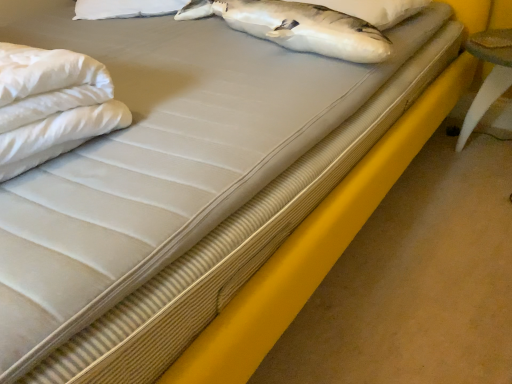
Find the location of a particular element. white soft pillow at upper center is located at coordinates (375, 9).

Describe the element at coordinates (375, 9) in the screenshot. I see `white soft pillow at upper center` at that location.

Where is `white soft fabric at left`? The image size is (512, 384). white soft fabric at left is located at coordinates (52, 105).

The image size is (512, 384). Describe the element at coordinates (52, 105) in the screenshot. I see `white soft fabric at left` at that location.

Where is `white soft pillow at upper center`? The height and width of the screenshot is (384, 512). white soft pillow at upper center is located at coordinates (375, 9).

Is white soft pillow at upper center at the left side of white soft fabric at left?

No, white soft pillow at upper center is not to the left of white soft fabric at left.

Considering their positions, is white soft pillow at upper center located in front of or behind white soft fabric at left?

white soft pillow at upper center is positioned farther from the viewer than white soft fabric at left.

Is point (361, 9) positioned before point (91, 69)?

No.

From the image's perspective, would you say white soft pillow at upper center is positioned over white soft fabric at left?

Yes, from the image's perspective, white soft pillow at upper center is over white soft fabric at left.

From a real-world perspective, is white soft pillow at upper center under white soft fabric at left?

Yes.

Considering the relative sizes of white soft pillow at upper center and white soft fabric at left in the image provided, is white soft pillow at upper center thinner than white soft fabric at left?

No.

Is white soft pillow at upper center taller or shorter than white soft fabric at left?

Considering their sizes, white soft pillow at upper center has less height than white soft fabric at left.

Which of these two, white soft pillow at upper center or white soft fabric at left, is smaller?

white soft pillow at upper center is smaller.

Is white soft pillow at upper center outside of white soft fabric at left?

Yes.

Are white soft pillow at upper center and white soft fabric at left located far from each other?

No.

Could you tell me if white soft pillow at upper center is facing white soft fabric at left?

Yes, white soft pillow at upper center faces towards white soft fabric at left.

How many degrees apart are the facing directions of white soft pillow at upper center and white soft fabric at left?

The facing directions of white soft pillow at upper center and white soft fabric at left are 7.92 degrees apart.

Where is `pillow located above the white soft fabric at left (from the image's perspective)`? Image resolution: width=512 pixels, height=384 pixels. pillow located above the white soft fabric at left (from the image's perspective) is located at coordinates point(375,9).

Does white soft fabric at left appear on the left side of white soft pillow at upper center?

Indeed, white soft fabric at left is positioned on the left side of white soft pillow at upper center.

In the scene shown: Which object is further away from the camera taking this photo, white soft fabric at left or white soft pillow at upper center?

white soft pillow at upper center is further away from the camera.

Which is less distant, (x=61, y=152) or (x=395, y=18)?

Point (x=61, y=152) appears to be closer to the viewer than point (x=395, y=18).

From the image's perspective, is white soft fabric at left over white soft pillow at upper center?

Incorrect, from the image's perspective, white soft fabric at left is lower than white soft pillow at upper center.

From a real-world perspective, is white soft fabric at left on top of white soft pillow at upper center?

Yes, from a real-world perspective, white soft fabric at left is over white soft pillow at upper center

Which object is thinner, white soft fabric at left or white soft pillow at upper center?

white soft fabric at left is thinner.

In terms of height, does white soft fabric at left look taller or shorter compared to white soft pillow at upper center?

Clearly, white soft fabric at left is taller compared to white soft pillow at upper center.

Can you confirm if white soft fabric at left is smaller than white soft pillow at upper center?

No.

Which is correct: white soft fabric at left is inside white soft pillow at upper center, or outside of it?

white soft fabric at left is outside white soft pillow at upper center.

Is white soft fabric at left not close to white soft pillow at upper center?

That's not correct — white soft fabric at left is a little close to white soft pillow at upper center.

Is white soft fabric at left oriented away from white soft pillow at upper center?

Answer: Absolutely, white soft fabric at left is directed away from white soft pillow at upper center.

How many degrees apart are the facing directions of white soft fabric at left and white soft pillow at upper center?

The angular difference between white soft fabric at left and white soft pillow at upper center is 7.92 degrees.

At what (x,y) coordinates should I click in order to perform the action: click on pillow behind the white soft fabric at left. Please return your answer as a coordinate pair (x, y). The height and width of the screenshot is (384, 512). Looking at the image, I should click on (375, 9).

The width and height of the screenshot is (512, 384). What are the coordinates of `sheet that is on the left side of white soft pillow at upper center` in the screenshot? It's located at (52, 105).

The height and width of the screenshot is (384, 512). I want to click on pillow lying above the white soft fabric at left (from the image's perspective), so click(x=375, y=9).